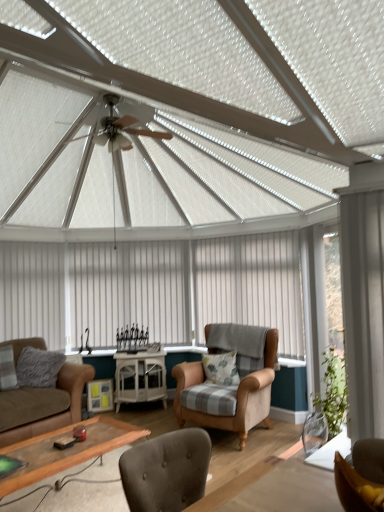
Question: Can you confirm if white fabric curtain at left, the first curtain from the left, is smaller than white sheer curtain at right, which is the 1th curtain in right-to-left order?

Choices:
 (A) no
 (B) yes

Answer: (A)

Question: Could you tell me if white fabric curtain at left, placed as the third curtain when sorted from front to back, is facing white sheer curtain at right, which is the 1th curtain in right-to-left order?

Choices:
 (A) no
 (B) yes

Answer: (B)

Question: Can you confirm if white fabric curtain at left, the 4th curtain positioned from the right, is shorter than white sheer curtain at right, which is the 4th curtain from back to front?

Choices:
 (A) yes
 (B) no

Answer: (B)

Question: Is white fabric curtain at left, which is the 2th curtain from back to front, placed right next to white sheer curtain at right, arranged as the first curtain when viewed from the front?

Choices:
 (A) yes
 (B) no

Answer: (B)

Question: Is white fabric curtain at left, placed as the third curtain when sorted from front to back, thinner than white sheer curtain at right, which is the 4th curtain from back to front?

Choices:
 (A) no
 (B) yes

Answer: (A)

Question: Considering the positions of fluffy gray pillow at center, the first pillow positioned from the right, and brown leather couch at lower left in the image, is fluffy gray pillow at center, the first pillow positioned from the right, wider or thinner than brown leather couch at lower left?

Choices:
 (A) thin
 (B) wide

Answer: (A)

Question: Considering the relative positions of fluffy gray pillow at center, the first pillow positioned from the right, and brown leather couch at lower left in the image provided, is fluffy gray pillow at center, the first pillow positioned from the right, to the left or to the right of brown leather couch at lower left?

Choices:
 (A) left
 (B) right

Answer: (B)

Question: From their relative heights in the image, would you say fluffy gray pillow at center, the 2th pillow in the left-to-right sequence, is taller or shorter than brown leather couch at lower left?

Choices:
 (A) tall
 (B) short

Answer: (B)

Question: Is point (221, 369) closer or farther from the camera than point (13, 396)?

Choices:
 (A) farther
 (B) closer

Answer: (A)

Question: Is point (147, 391) positioned closer to the camera than point (92, 430)?

Choices:
 (A) closer
 (B) farther

Answer: (B)

Question: Looking at their shapes, would you say white glossy cabinet at center is wider or thinner than wooden glass coffee table at lower center?

Choices:
 (A) wide
 (B) thin

Answer: (B)

Question: From a real-world perspective, is white glossy cabinet at center positioned above or below wooden glass coffee table at lower center?

Choices:
 (A) below
 (B) above

Answer: (B)

Question: Considering their positions, is white glossy cabinet at center located in front of or behind wooden glass coffee table at lower center?

Choices:
 (A) front
 (B) behind

Answer: (B)

Question: From a real-world perspective, is wooden glass coffee table at lower center above or below brown leather couch at lower left?

Choices:
 (A) below
 (B) above

Answer: (A)

Question: In terms of size, does wooden glass coffee table at lower center appear bigger or smaller than brown leather couch at lower left?

Choices:
 (A) big
 (B) small

Answer: (B)